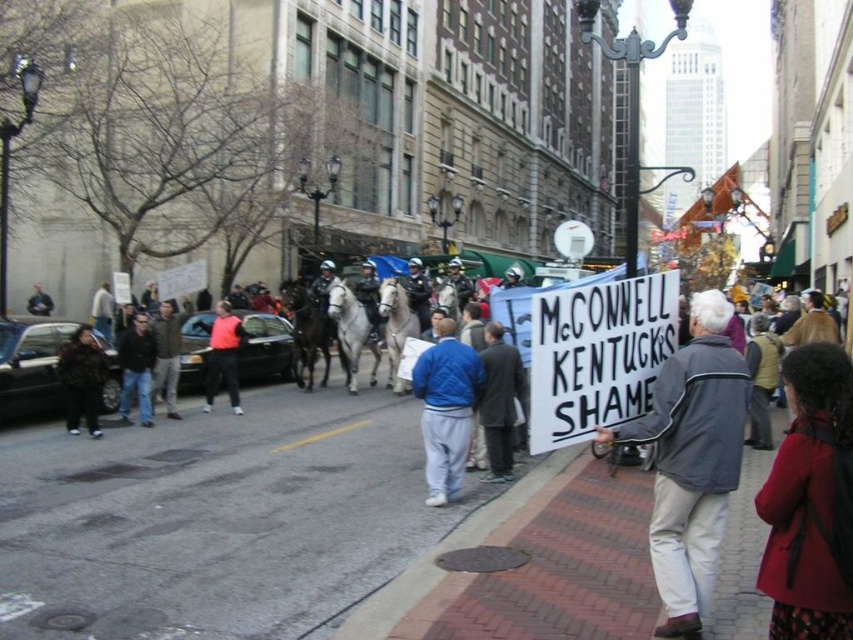
Question: Can you confirm if dark gray coat at center is positioned to the right of orange reflective vest at center?

Choices:
 (A) yes
 (B) no

Answer: (A)

Question: Estimate the real-world distances between objects in this image. Which object is farther from the dark gray jacket at center?

Choices:
 (A) orange reflective vest at center
 (B) dark blue jacket at center

Answer: (B)

Question: Can you confirm if dark gray coat at center is smaller than dark blue jeans at left?

Choices:
 (A) yes
 (B) no

Answer: (A)

Question: Which point is closer to the camera?

Choices:
 (A) (500, 403)
 (B) (7, 637)

Answer: (B)

Question: Considering the relative positions of dark blue jeans at left and dark gray jacket at center in the image provided, where is dark blue jeans at left located with respect to dark gray jacket at center?

Choices:
 (A) above
 (B) below

Answer: (B)

Question: Estimate the real-world distances between objects in this image. Which object is farther from the red wool coat at lower right?

Choices:
 (A) dark blue jacket at center
 (B) dark blue jeans at left

Answer: (A)